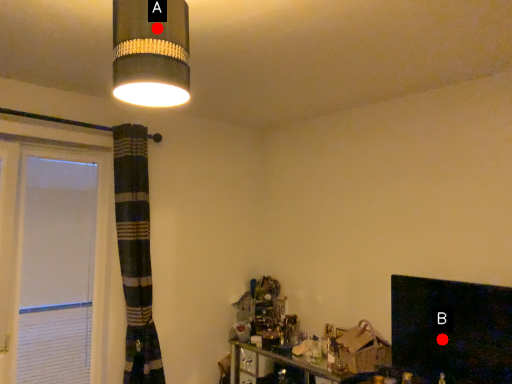
Question: Two points are circled on the image, labeled by A and B beside each circle. Which point is closer to the camera taking this photo?

Choices:
 (A) A is closer
 (B) B is closer

Answer: (A)